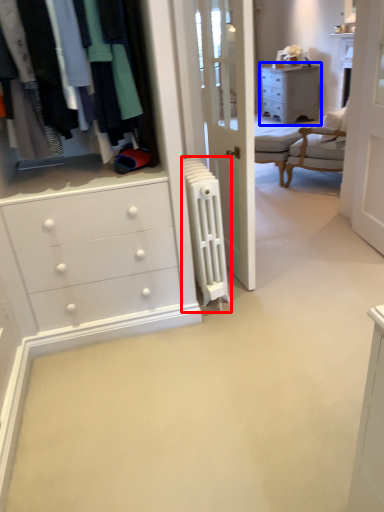
Question: Which object is closer to the camera taking this photo, radiator (highlighted by a red box) or chest of drawers (highlighted by a blue box)?

Choices:
 (A) radiator
 (B) chest of drawers

Answer: (A)